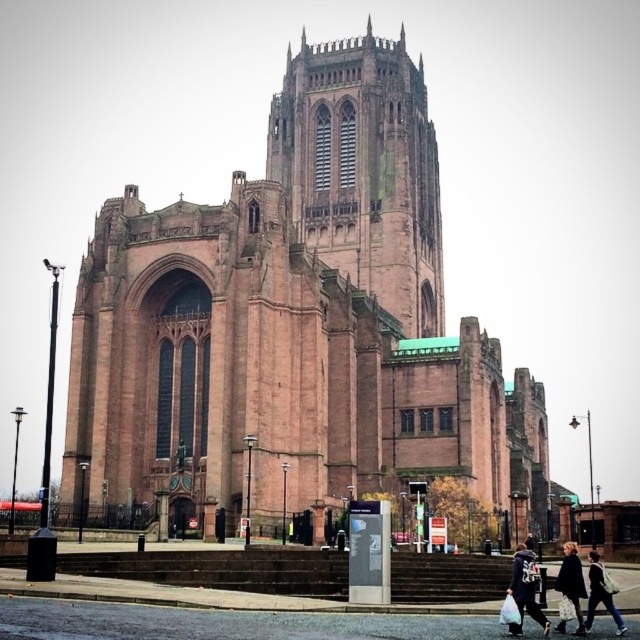
Does reddish-brown stone church at center appear on the left side of dark brown leather jacket at lower right?

Indeed, reddish-brown stone church at center is positioned on the left side of dark brown leather jacket at lower right.

Is reddish-brown stone church at center smaller than dark brown leather jacket at lower right?

Incorrect, reddish-brown stone church at center is not smaller in size than dark brown leather jacket at lower right.

Describe the element at coordinates (298, 324) in the screenshot. I see `reddish-brown stone church at center` at that location.

Locate an element on the screen. This screenshot has width=640, height=640. reddish-brown stone church at center is located at coordinates (298, 324).

Does brown stone tower at center appear on the right side of fluffy black coat at lower right?

Incorrect, brown stone tower at center is not on the right side of fluffy black coat at lower right.

Which is above, brown stone tower at center or fluffy black coat at lower right?

→ brown stone tower at center is above.

Who is more forward, (394, 81) or (576, 600)?

Point (576, 600) is in front.

This screenshot has height=640, width=640. What are the coordinates of `brown stone tower at center` in the screenshot? It's located at (364, 170).

Based on the photo, is brown stone tower at center closer to camera compared to denim jacket at lower right?

No, it is behind denim jacket at lower right.

Does point (275, 118) lie in front of point (572, 595)?

No, (275, 118) is behind (572, 595).

Identify the location of brown stone tower at center. (364, 170).